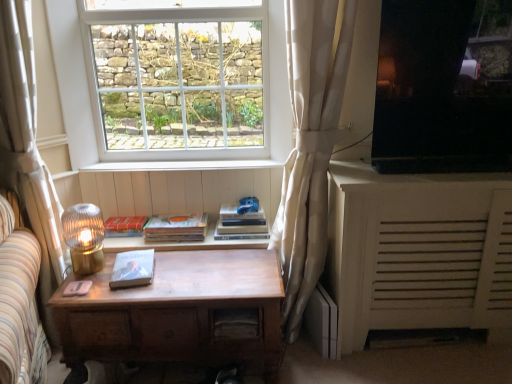
This screenshot has height=384, width=512. Describe the element at coordinates (241, 224) in the screenshot. I see `hardcover book at center` at that location.

In order to face white textured curtain at center, placed as the second curtain when sorted from left to right, should I rotate leftwards or rightwards?

Rotate right and turn 8.242 degrees.

What do you see at coordinates (27, 136) in the screenshot? This screenshot has height=384, width=512. I see `white textured curtain at left, the 2th curtain viewed from the right` at bounding box center [27, 136].

What do you see at coordinates (125, 226) in the screenshot? The image size is (512, 384). I see `matte red paperback book at center, which is counted as the 1th paperback book, starting from the back` at bounding box center [125, 226].

Measure the distance between point (383, 16) and camera.

Point (383, 16) is 1.72 meters away from camera.

At what (x,y) coordinates should I click in order to perform the action: click on hardcover book at center. Please return your answer as a coordinate pair (x, y). Looking at the image, I should click on (241, 224).

Is white textured curtain at left, the 2th curtain viewed from the right, not near white wood at center?

No.

Which object is closer to the camera, white textured curtain at left, the first curtain in the left-to-right sequence, or white wood at center?

Positioned in front is white textured curtain at left, the first curtain in the left-to-right sequence.

Would you say white textured curtain at left, the first curtain in the left-to-right sequence, is inside or outside white wood at center?

white textured curtain at left, the first curtain in the left-to-right sequence, lies outside white wood at center.

Does point (477, 61) lie behind point (132, 257)?

No, (477, 61) is closer to viewer.

Does black glossy tv at upper right appear on the left side of matte white paperback book at center, marked as the 1th paperback book in a front-to-back arrangement?

No.

Are black glossy tv at upper right and matte white paperback book at center, marked as the 1th paperback book in a front-to-back arrangement, making contact?

black glossy tv at upper right and matte white paperback book at center, marked as the 1th paperback book in a front-to-back arrangement, are clearly separated.

Can you confirm if black glossy tv at upper right is wider than matte white paperback book at center, marked as the 1th paperback book in a front-to-back arrangement?

Incorrect, the width of black glossy tv at upper right does not surpass that of matte white paperback book at center, marked as the 1th paperback book in a front-to-back arrangement.

You are a GUI agent. You are given a task and a screenshot of the screen. Output one action in this format:
    pyautogui.click(x=<x>, y=<y>)
    Task: Click on the lamp directly beneath the white textured curtain at center, placed as the second curtain when sorted from left to right (from a real-world perspective)
    The width and height of the screenshot is (512, 384).
    Given the screenshot: What is the action you would take?
    [84, 237]

In terms of height, does white textured curtain at center, the first curtain viewed from the right, look taller or shorter compared to gold metallic lamp at left?

white textured curtain at center, the first curtain viewed from the right, is taller than gold metallic lamp at left.

Is the surface of white textured curtain at center, the first curtain viewed from the right, in direct contact with gold metallic lamp at left?

No, white textured curtain at center, the first curtain viewed from the right, is not in contact with gold metallic lamp at left.

Is white textured curtain at center, placed as the second curtain when sorted from left to right, wider or thinner than gold metallic lamp at left?

Clearly, white textured curtain at center, placed as the second curtain when sorted from left to right, has more width compared to gold metallic lamp at left.

Could wooden desk at center be considered to be inside white wood at center?

That's incorrect, wooden desk at center is not inside white wood at center.

Considering the points (231, 162) and (72, 356), which point is in front, point (231, 162) or point (72, 356)?

The point (72, 356) is closer to the camera.

In the image, is white wood at center positioned in front of or behind wooden desk at center?

white wood at center is positioned farther from the viewer than wooden desk at center.

Find the location of a particular element. This screenshot has height=384, width=512. window sill above the wooden desk at center (from a real-world perspective) is located at coordinates (180, 165).

Between white textured curtain at left, the 2th curtain viewed from the right, and hardcover book at center, which one appears on the right side from the viewer's perspective?

Positioned to the right is hardcover book at center.

How different are the orientations of white textured curtain at left, the 2th curtain viewed from the right, and hardcover book at center in degrees?

white textured curtain at left, the 2th curtain viewed from the right, and hardcover book at center are facing 1.19 degrees away from each other.

Between white textured curtain at left, the 2th curtain viewed from the right, and hardcover book at center, which one is positioned behind?

hardcover book at center is further from the camera.

Does white textured curtain at left, the 2th curtain viewed from the right, have a lesser width compared to hardcover book at center?

Yes, white textured curtain at left, the 2th curtain viewed from the right, is thinner than hardcover book at center.

What's the angular difference between white textured curtain at left, the first curtain in the left-to-right sequence, and wooden desk at center's facing directions?

white textured curtain at left, the first curtain in the left-to-right sequence, and wooden desk at center are facing 1.65 degrees away from each other.

Considering the relative sizes of white textured curtain at left, the first curtain in the left-to-right sequence, and wooden desk at center in the image provided, is white textured curtain at left, the first curtain in the left-to-right sequence, bigger than wooden desk at center?

Actually, white textured curtain at left, the first curtain in the left-to-right sequence, might be smaller than wooden desk at center.

From a real-world perspective, who is located higher, white textured curtain at left, the first curtain in the left-to-right sequence, or wooden desk at center?

white textured curtain at left, the first curtain in the left-to-right sequence.

Consider the image. In the image, is white textured curtain at left, the first curtain in the left-to-right sequence, positioned in front of or behind wooden desk at center?

In the image, white textured curtain at left, the first curtain in the left-to-right sequence, appears in front of wooden desk at center.

Consider the image. Is the depth of hardcover book at center less than that of white textured cabinet at right?

No, hardcover book at center is behind white textured cabinet at right.

Consider the image. Considering the sizes of objects hardcover book at center and white textured cabinet at right in the image provided, who is shorter, hardcover book at center or white textured cabinet at right?

With less height is hardcover book at center.

Locate an element on the screen. The width and height of the screenshot is (512, 384). book on the left of the white textured cabinet at right is located at coordinates (241, 224).

Consider the image. Is hardcover book at center bigger or smaller than white textured cabinet at right?

In the image, hardcover book at center appears to be smaller than white textured cabinet at right.

Where is `window sill that appears above the white textured curtain at left, the 2th curtain viewed from the right (from the image's perspective)`? This screenshot has height=384, width=512. window sill that appears above the white textured curtain at left, the 2th curtain viewed from the right (from the image's perspective) is located at coordinates (180, 165).

The height and width of the screenshot is (384, 512). I want to click on television in front of the matte white paperback book at center, the third paperback book when ordered from back to front, so click(x=442, y=89).

When comparing their distances from white wood at center, does hardcover book at center, which appears as the second paperback book when viewed from the back, or white textured curtain at center, the first curtain viewed from the right, seem closer?

hardcover book at center, which appears as the second paperback book when viewed from the back, lies closer to white wood at center than the other object.

Considering their positions, is wooden drawer at center positioned closer to matte red paperback book at center, which is counted as the 1th paperback book, starting from the back, than matte white paperback book at center, the third paperback book when ordered from back to front?

matte white paperback book at center, the third paperback book when ordered from back to front.

Looking at this image, when comparing their distances from white textured curtain at left, the 2th curtain viewed from the right, does hardcover book at center or hardcover book at center, which appears as the second paperback book when viewed from the back, seem further?

hardcover book at center is positioned further to the anchor white textured curtain at left, the 2th curtain viewed from the right.

Considering their positions, is matte red paperback book at center, which is the 3th paperback book in front-to-back order, positioned further to gold metallic lamp at left than hardcover book at center, which appears as the second paperback book when viewed from the front?

hardcover book at center, which appears as the second paperback book when viewed from the front, is positioned further to the anchor gold metallic lamp at left.

Which object lies further to the anchor point gold metallic lamp at left, matte white paperback book at center, marked as the 1th paperback book in a front-to-back arrangement, or black glossy tv at upper right?

black glossy tv at upper right is positioned further to the anchor gold metallic lamp at left.

From the image, which object appears to be farther from matte red paperback book at center, which is the 3th paperback book in front-to-back order, wooden drawer at center or gold metallic lamp at left?

The object further to matte red paperback book at center, which is the 3th paperback book in front-to-back order, is wooden drawer at center.

Considering their positions, is white textured curtain at left, the 2th curtain viewed from the right, positioned further to white wood at center than white textured cabinet at right?

Based on the image, white textured cabinet at right appears to be further to white wood at center.

When comparing their distances from white wood at center, does white textured curtain at left, the first curtain in the left-to-right sequence, or white textured curtain at center, the first curtain viewed from the right, seem further?

white textured curtain at center, the first curtain viewed from the right, is further to white wood at center.

Image resolution: width=512 pixels, height=384 pixels. In order to click on book located between matte red paperback book at center, which is the 3th paperback book in front-to-back order, and white textured cabinet at right in the left-right direction in this screenshot , I will do `click(241, 224)`.

The image size is (512, 384). I want to click on book between white glass window at upper center and gold metallic lamp at left vertically, so pyautogui.click(x=241, y=224).

You are a GUI agent. You are given a task and a screenshot of the screen. Output one action in this format:
    pyautogui.click(x=<x>, y=<y>)
    Task: Click on the paperback book located between matte white paperback book at center, marked as the 1th paperback book in a front-to-back arrangement, and white textured curtain at center, the first curtain viewed from the right, in the left-right direction
    
    Given the screenshot: What is the action you would take?
    pyautogui.click(x=176, y=228)

Locate an element on the screen. Image resolution: width=512 pixels, height=384 pixels. book between hardcover book at center, which appears as the second paperback book when viewed from the back, and white textured cabinet at right, in the horizontal direction is located at coordinates coord(241,224).